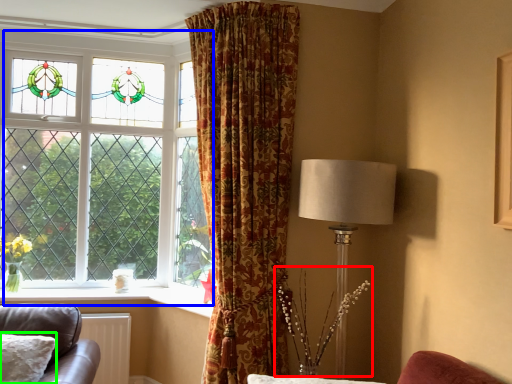
Question: Based on their relative distances, which object is nearer to floral arrangement (highlighted by a red box)? Choose from window (highlighted by a blue box) and pillow (highlighted by a green box).

Choices:
 (A) window
 (B) pillow

Answer: (B)